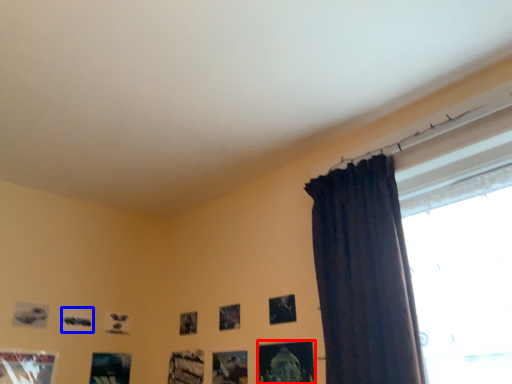
Question: Which object appears farthest to the camera in this image, picture frame (highlighted by a red box) or picture frame (highlighted by a blue box)?

Choices:
 (A) picture frame
 (B) picture frame

Answer: (B)